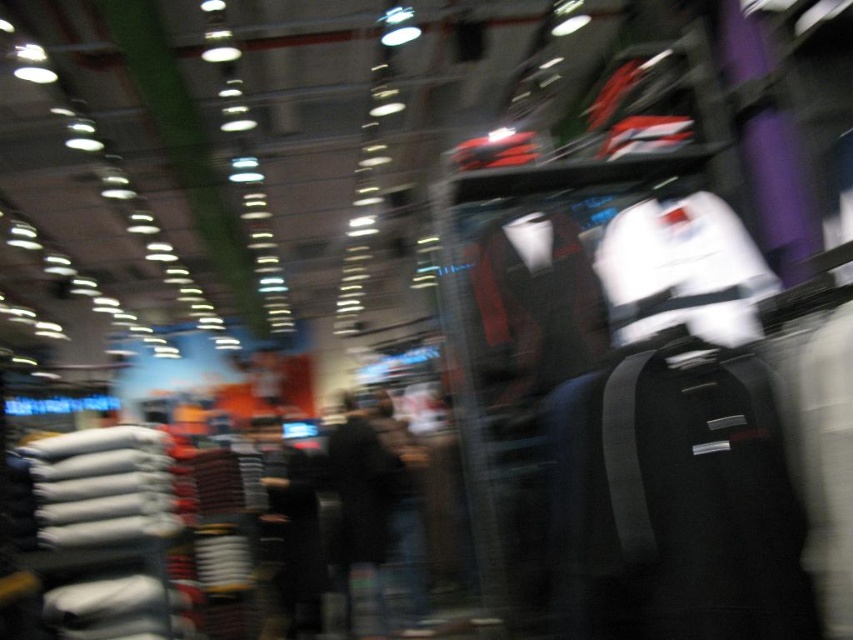
You are standing in the retail store and want to move from the point at coordinates point (x=637, y=564) to the point at coordinates point (x=381, y=444). Can you walk directly between them without any obstacles?

Point (x=637, y=564) is in front of point (x=381, y=444), so there might be obstacles between them. You cannot walk directly between them without any obstacles.

You are a customer in the store and want to pick up the black fabric bag at right. Based on the coordinates provided, where should you look to find it?

The black fabric bag at right is located at coordinates point (675,500), so you should look towards the lower right area of the image to find it.